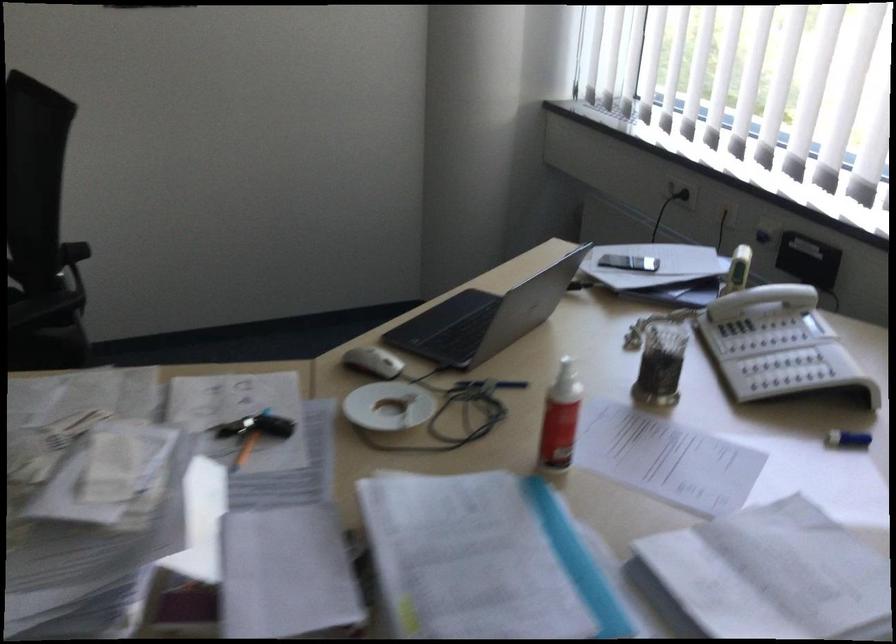
Where is `black smartphone`? The image size is (896, 644). black smartphone is located at coordinates click(x=484, y=317).